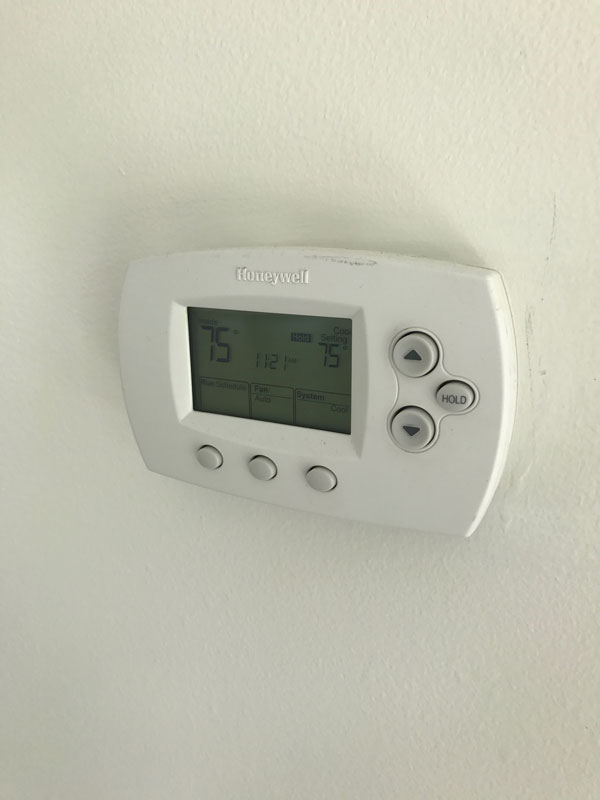
Where is `shadow on wall`? This screenshot has height=800, width=600. shadow on wall is located at coordinates (209, 213).